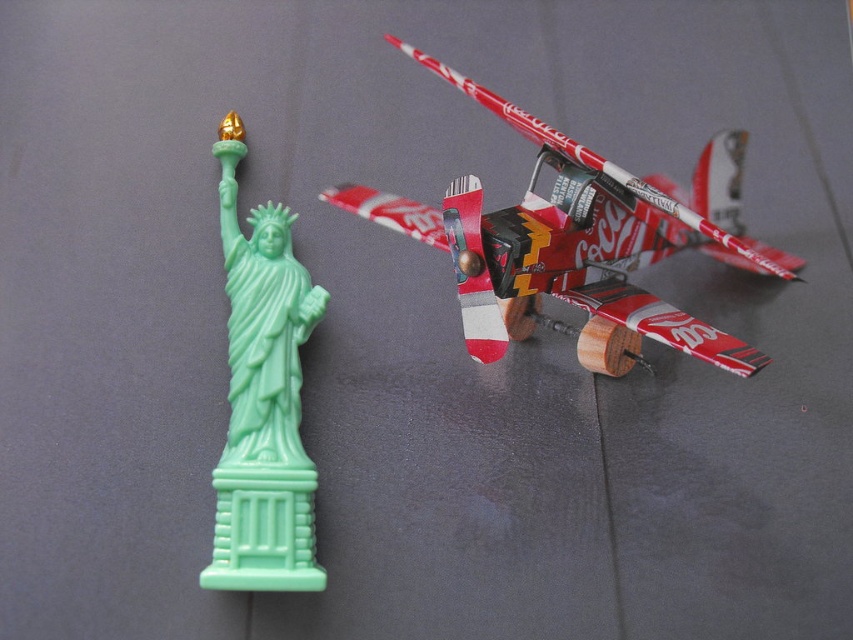
Is red and white paper airplane at right above mint green plastic statue of liberty at left?

Correct, red and white paper airplane at right is located above mint green plastic statue of liberty at left.

Which is more to the left, red and white paper airplane at right or mint green plastic statue of liberty at left?

From the viewer's perspective, mint green plastic statue of liberty at left appears more on the left side.

In order to click on red and white paper airplane at right in this screenshot , I will do pyautogui.click(x=579, y=243).